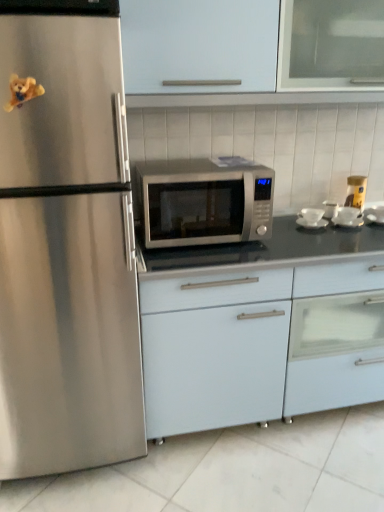
Locate an element on the screen. This screenshot has width=384, height=512. white glossy bowl at right, placed as the 1th appliance when sorted from left to right is located at coordinates (310, 216).

What do you see at coordinates (204, 203) in the screenshot?
I see `satin silver microwave at center` at bounding box center [204, 203].

Image resolution: width=384 pixels, height=512 pixels. Describe the element at coordinates (348, 217) in the screenshot. I see `satin silver microwave at center, placed as the 2th appliance when sorted from left to right` at that location.

Based on the photo, measure the distance between white matte cabinet at center, which is counted as the 1th cabinetry, starting from the bottom, and camera.

white matte cabinet at center, which is counted as the 1th cabinetry, starting from the bottom, is 5.00 feet from camera.

Image resolution: width=384 pixels, height=512 pixels. Identify the location of white glossy bowl at right, placed as the third appliance when sorted from right to left. (310, 216).

Is the position of yellow matte jar at upper right, the first appliance in the right-to-left sequence, less distant than that of white glossy bowl at right, placed as the 1th appliance when sorted from left to right?

No, yellow matte jar at upper right, the first appliance in the right-to-left sequence, is further to the viewer.

From a real-world perspective, is yellow matte jar at upper right, the first appliance in the right-to-left sequence, below white glossy bowl at right, placed as the third appliance when sorted from right to left?

No, from a real-world perspective, yellow matte jar at upper right, the first appliance in the right-to-left sequence, is not below white glossy bowl at right, placed as the third appliance when sorted from right to left.

From the image's perspective, which is above, yellow matte jar at upper right, the first appliance in the right-to-left sequence, or white glossy bowl at right, placed as the 1th appliance when sorted from left to right?

yellow matte jar at upper right, the first appliance in the right-to-left sequence, is shown above in the image.

I want to click on the 2nd appliance above the white glossy bowl at right, placed as the 1th appliance when sorted from left to right (from the image's perspective), so click(356, 192).

Is white glossy tile at lower center with white glossy bowl at right, placed as the third appliance when sorted from right to left?

No, white glossy tile at lower center is not in contact with white glossy bowl at right, placed as the third appliance when sorted from right to left.

Identify the location of the 1st appliance above when counting from the white glossy tile at lower center (from the image's perspective). The image size is (384, 512). (310, 216).

Is white glossy tile at lower center inside the boundaries of white glossy bowl at right, placed as the third appliance when sorted from right to left, or outside?

white glossy tile at lower center is located beyond the bounds of white glossy bowl at right, placed as the third appliance when sorted from right to left.

Between point (182, 189) and point (372, 492), which one is positioned behind?

The point (372, 492) is behind.

From the picture: Does satin silver microwave at center contain white glossy tile at lower center?

That's incorrect, white glossy tile at lower center is not inside satin silver microwave at center.

From the image's perspective, is satin silver microwave at center on top of white glossy tile at lower center?

Correct, satin silver microwave at center appears higher than white glossy tile at lower center in the image.

Is satin silver microwave at center further to camera compared to white glossy tile at lower center?

Yes, satin silver microwave at center is behind white glossy tile at lower center.

Between white glossy tile at lower center and white glossy cabinet at upper center, acting as the 2th cabinetry starting from the bottom, which one appears on the left side from the viewer's perspective?

From the viewer's perspective, white glossy tile at lower center appears more on the left side.

From the image's perspective, which is below, white glossy tile at lower center or white glossy cabinet at upper center, acting as the 2th cabinetry starting from the bottom?

white glossy tile at lower center is shown below in the image.

Locate an element on the screen. The width and height of the screenshot is (384, 512). tile located in front of the white glossy cabinet at upper center, acting as the 2th cabinetry starting from the bottom is located at coordinates (233, 471).

Can you confirm if white glossy tile at lower center is shorter than white glossy cabinet at upper center, which ranks as the 1th cabinetry in top-to-bottom order?

Correct, white glossy tile at lower center is not as tall as white glossy cabinet at upper center, which ranks as the 1th cabinetry in top-to-bottom order.

Can you tell me how much white glossy tile at lower center and satin silver microwave at center, the second appliance in the right-to-left sequence, differ in facing direction?

The facing directions of white glossy tile at lower center and satin silver microwave at center, the second appliance in the right-to-left sequence, are 90.8 degrees apart.

Is point (172, 459) positioned behind point (338, 222)?

No, it is not.

Is there a large distance between white glossy tile at lower center and satin silver microwave at center, placed as the 2th appliance when sorted from left to right?

Yes, white glossy tile at lower center and satin silver microwave at center, placed as the 2th appliance when sorted from left to right, are located far from each other.

Is white glossy tile at lower center looking in the opposite direction of satin silver microwave at center, placed as the 2th appliance when sorted from left to right?

No, white glossy tile at lower center is not facing the opposite direction of satin silver microwave at center, placed as the 2th appliance when sorted from left to right.

Considering the relative positions of satin silver microwave at center and white glossy cabinet at upper center, which ranks as the 1th cabinetry in top-to-bottom order, in the image provided, is satin silver microwave at center to the left of white glossy cabinet at upper center, which ranks as the 1th cabinetry in top-to-bottom order, from the viewer's perspective?

Yes, satin silver microwave at center is to the left of white glossy cabinet at upper center, which ranks as the 1th cabinetry in top-to-bottom order.

How different are the orientations of satin silver microwave at center and white glossy cabinet at upper center, acting as the 2th cabinetry starting from the bottom, in degrees?

0.1 degrees.

Is satin silver microwave at center spatially inside white glossy cabinet at upper center, acting as the 2th cabinetry starting from the bottom, or outside of it?

satin silver microwave at center is not inside white glossy cabinet at upper center, acting as the 2th cabinetry starting from the bottom, it's outside.

Is point (144, 206) farther from camera compared to point (218, 38)?

Yes, it is.

What's the angular difference between satin silver microwave at center and white glossy bowl at right, placed as the 1th appliance when sorted from left to right,'s facing directions?

The facing directions of satin silver microwave at center and white glossy bowl at right, placed as the 1th appliance when sorted from left to right, are 1.92 degrees apart.

Considering the sizes of objects satin silver microwave at center and white glossy bowl at right, placed as the third appliance when sorted from right to left, in the image provided, who is wider, satin silver microwave at center or white glossy bowl at right, placed as the third appliance when sorted from right to left,?

A: Wider between the two is satin silver microwave at center.

Which of these two, satin silver microwave at center or white glossy bowl at right, placed as the 1th appliance when sorted from left to right, stands taller?

With more height is satin silver microwave at center.

Is satin silver microwave at center facing towards white glossy bowl at right, placed as the 1th appliance when sorted from left to right?

No, satin silver microwave at center is not facing towards white glossy bowl at right, placed as the 1th appliance when sorted from left to right.

Image resolution: width=384 pixels, height=512 pixels. I want to click on the 2nd appliance above when counting from the white glossy bowl at right, placed as the 1th appliance when sorted from left to right (from the image's perspective), so click(356, 192).

Where is `tile to the left of white glossy bowl at right, placed as the third appliance when sorted from right to left`? tile to the left of white glossy bowl at right, placed as the third appliance when sorted from right to left is located at coordinates (233, 471).

Based on their spatial positions, is white glossy bowl at right, placed as the 1th appliance when sorted from left to right, or satin silver microwave at center closer to white glossy tile at lower center?

Among the two, satin silver microwave at center is located nearer to white glossy tile at lower center.

When comparing their distances from white glossy tile at lower center, does white matte cabinet at center, which is the 2th cabinetry from top to bottom, or white glossy cabinet at upper center, which ranks as the 1th cabinetry in top-to-bottom order, seem further?

The object further to white glossy tile at lower center is white glossy cabinet at upper center, which ranks as the 1th cabinetry in top-to-bottom order.

Looking at the image, which one is located further to white matte cabinet at center, which is the 2th cabinetry from top to bottom, white glossy tile at lower center or satin silver microwave at center?

satin silver microwave at center.

In the scene shown: Looking at the image, which one is located further to satin silver microwave at center, white glossy cabinet at upper center, acting as the 2th cabinetry starting from the bottom, or yellow matte jar at upper right, arranged as the third appliance when viewed from the left?

yellow matte jar at upper right, arranged as the third appliance when viewed from the left.

Estimate the real-world distances between objects in this image. Which object is further from satin silver microwave at center, yellow matte jar at upper right, the first appliance in the right-to-left sequence, or white glossy bowl at right, placed as the 1th appliance when sorted from left to right?

yellow matte jar at upper right, the first appliance in the right-to-left sequence, lies further to satin silver microwave at center than the other object.

Considering their positions, is white glossy cabinet at upper center, which ranks as the 1th cabinetry in top-to-bottom order, positioned further to satin silver microwave at center, placed as the 2th appliance when sorted from left to right, than white glossy tile at lower center?

white glossy tile at lower center is further to satin silver microwave at center, placed as the 2th appliance when sorted from left to right.

Looking at the image, which one is located closer to satin silver microwave at center, white glossy tile at lower center or white glossy cabinet at upper center, which ranks as the 1th cabinetry in top-to-bottom order?

white glossy cabinet at upper center, which ranks as the 1th cabinetry in top-to-bottom order.

Estimate the real-world distances between objects in this image. Which object is closer to white matte cabinet at center, which is counted as the 1th cabinetry, starting from the bottom, yellow matte jar at upper right, the first appliance in the right-to-left sequence, or white glossy cabinet at upper center, acting as the 2th cabinetry starting from the bottom?

The object closer to white matte cabinet at center, which is counted as the 1th cabinetry, starting from the bottom, is yellow matte jar at upper right, the first appliance in the right-to-left sequence.

This screenshot has height=512, width=384. Identify the location of appliance between white glossy cabinet at upper center, acting as the 2th cabinetry starting from the bottom, and satin silver microwave at center, placed as the 2th appliance when sorted from left to right, in the front-back direction. (310, 216).

This screenshot has width=384, height=512. Find the location of `cabinetry between white glossy bowl at right, placed as the third appliance when sorted from right to left, and white glossy tile at lower center vertically`. cabinetry between white glossy bowl at right, placed as the third appliance when sorted from right to left, and white glossy tile at lower center vertically is located at coordinates click(260, 344).

Identify the location of microwave oven that lies between white glossy cabinet at upper center, which ranks as the 1th cabinetry in top-to-bottom order, and white matte cabinet at center, which is counted as the 1th cabinetry, starting from the bottom, from top to bottom. (204, 203).

The image size is (384, 512). What are the coordinates of `cabinetry between satin silver microwave at center and white glossy tile at lower center in the vertical direction` in the screenshot? It's located at (260, 344).